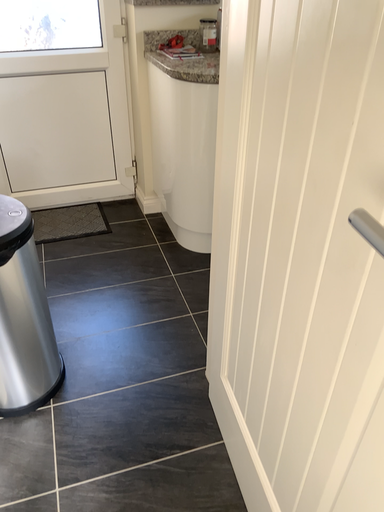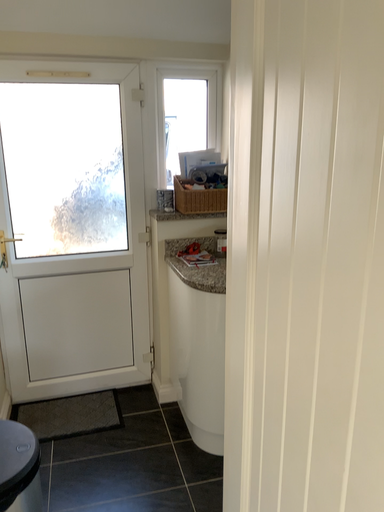
Question: How did the camera likely rotate when shooting the video?

Choices:
 (A) rotated upward
 (B) rotated downward

Answer: (A)